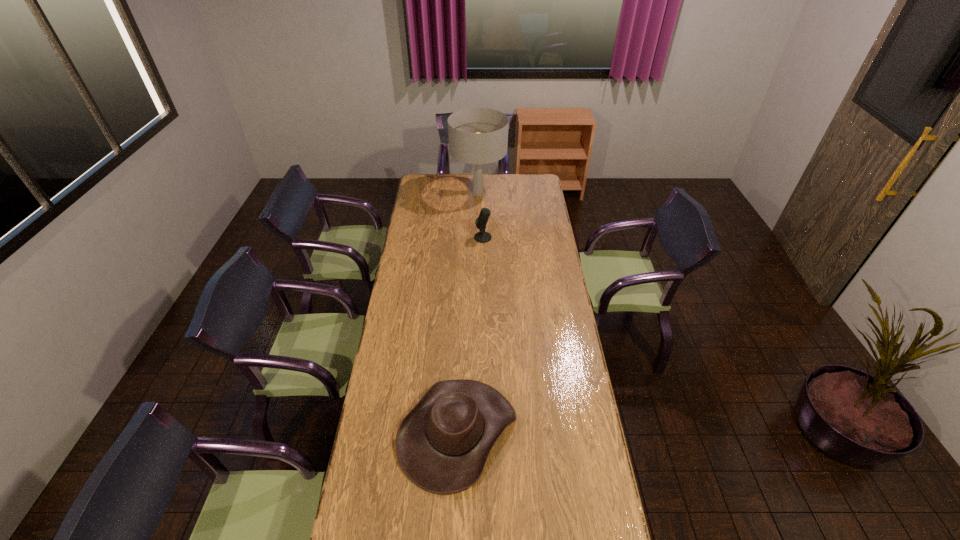
Locate an element on the screen. The width and height of the screenshot is (960, 540). the farthest object is located at coordinates (478, 136).

At what (x,y) coordinates should I click in order to perform the action: click on the tallest object. Please return your answer as a coordinate pair (x, y). The width and height of the screenshot is (960, 540). Looking at the image, I should click on (x=478, y=136).

This screenshot has width=960, height=540. I want to click on the second nearest object, so click(482, 237).

Where is `microphone`? This screenshot has width=960, height=540. microphone is located at coordinates (482, 237).

The image size is (960, 540). Find the location of `the shortest object`. the shortest object is located at coordinates (442, 444).

Where is `cowboy hat`? The width and height of the screenshot is (960, 540). cowboy hat is located at coordinates (442, 444).

Identify the location of free space located on the front-facing side of the farthest object. (478, 227).

You are a GUI agent. You are given a task and a screenshot of the screen. Output one action in this format:
    pyautogui.click(x=<x>, y=<y>)
    Task: Click on the vacant space located on the left of the microphone
    The width and height of the screenshot is (960, 540).
    Given the screenshot: What is the action you would take?
    pyautogui.click(x=445, y=238)

Image resolution: width=960 pixels, height=540 pixels. I want to click on blank space located on the left of the shortest object, so click(384, 432).

Locate an element on the screen. The height and width of the screenshot is (540, 960). object that is at the far edge is located at coordinates (478, 136).